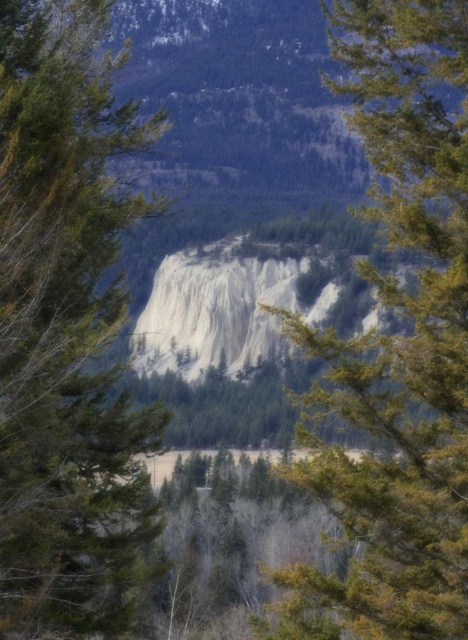
You are a hiker planning to walk between the green matte tree at center and the green textured tree at center. Which tree has a narrower width, making it easier to pass through the gap between them?

The green matte tree at center has a narrower width compared to the green textured tree at center, so it would be easier to pass through the gap between them.

You are standing at the edge of a mountain trail and see the green matte tree at center and the green textured tree at center ahead. Which tree is closer to you?

The green matte tree at center is closer to you because it is positioned further to the viewer than the green textured tree at center.